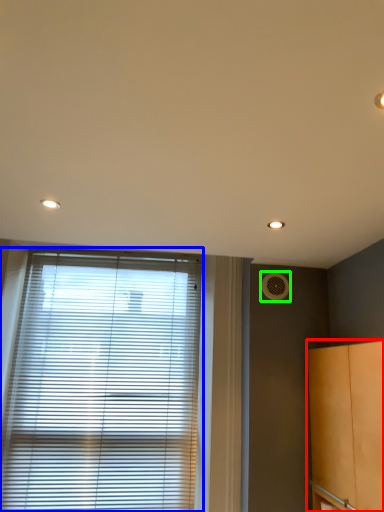
Question: Which is farther away from cabinetry (highlighted by a red box)? window blind (highlighted by a blue box) or air conditioning (highlighted by a green box)?

Choices:
 (A) window blind
 (B) air conditioning

Answer: (A)